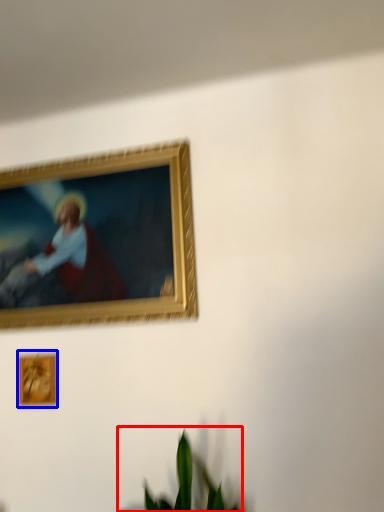
Question: Among these objects, which one is nearest to the camera, houseplant (highlighted by a red box) or picture frame (highlighted by a blue box)?

Choices:
 (A) houseplant
 (B) picture frame

Answer: (A)